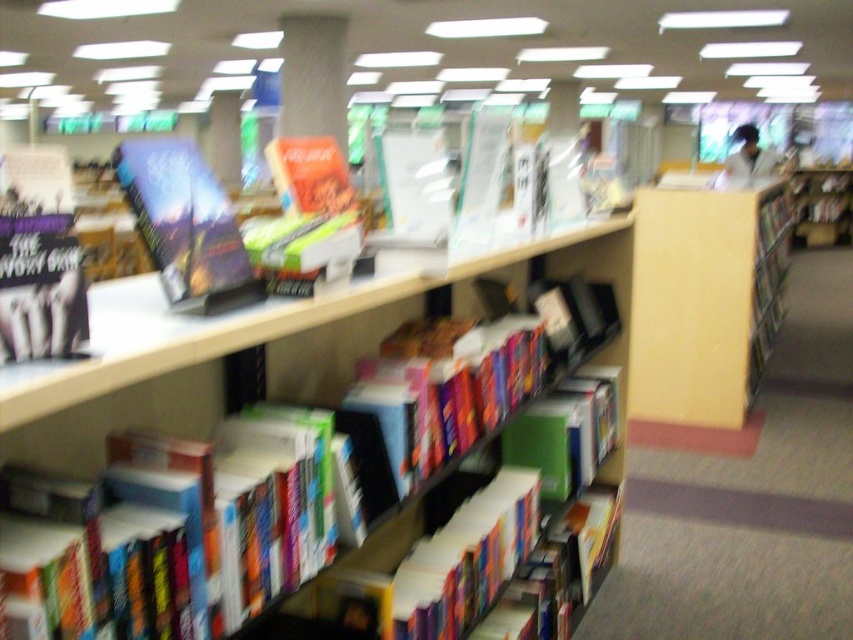
Question: Does yellow matte bookshelf at center appear over hardcover book at left?

Choices:
 (A) yes
 (B) no

Answer: (A)

Question: Which is farther from the hardcover books at center?

Choices:
 (A) hardcover book at upper left
 (B) hardcover book at left

Answer: (B)

Question: Is yellow matte bookshelf at center wider than hardcover books at center?

Choices:
 (A) no
 (B) yes

Answer: (B)

Question: Among these points, which one is nearest to the camera?

Choices:
 (A) (547, 243)
 (B) (128, 180)

Answer: (B)

Question: Is yellow matte bookshelf at center above hardcover books at center?

Choices:
 (A) yes
 (B) no

Answer: (A)

Question: Which of the following is the closest to the observer?

Choices:
 (A) hardcover book at left
 (B) hardcover book at upper left
 (C) hardcover books at center

Answer: (C)